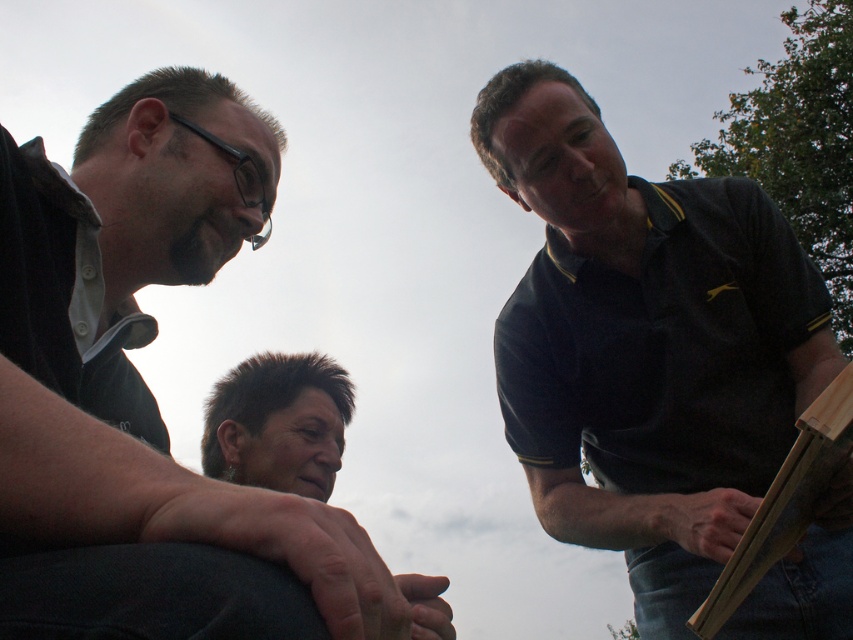
Looking at this image, can you confirm if matte black shirt at left is taller than wooden frame at right?

Yes.

Which is above, matte black shirt at left or wooden frame at right?

Positioned higher is matte black shirt at left.

What do you see at coordinates (154, 400) in the screenshot?
I see `matte black shirt at left` at bounding box center [154, 400].

Where is `matte black shirt at left`? This screenshot has height=640, width=853. matte black shirt at left is located at coordinates (154, 400).

Is black jersey at upper right taller than wooden frame at right?

Indeed, black jersey at upper right has a greater height compared to wooden frame at right.

Is black jersey at upper right further to camera compared to wooden frame at right?

Yes, black jersey at upper right is further from the viewer.

Image resolution: width=853 pixels, height=640 pixels. Describe the element at coordinates (645, 342) in the screenshot. I see `black jersey at upper right` at that location.

Locate an element on the screen. The image size is (853, 640). black jersey at upper right is located at coordinates (645, 342).

Is matte black shirt at left in front of black jersey at upper right?

Yes, matte black shirt at left is in front of black jersey at upper right.

Between matte black shirt at left and black jersey at upper right, which one appears on the left side from the viewer's perspective?

From the viewer's perspective, matte black shirt at left appears more on the left side.

The height and width of the screenshot is (640, 853). Find the location of `matte black shirt at left`. matte black shirt at left is located at coordinates (154, 400).